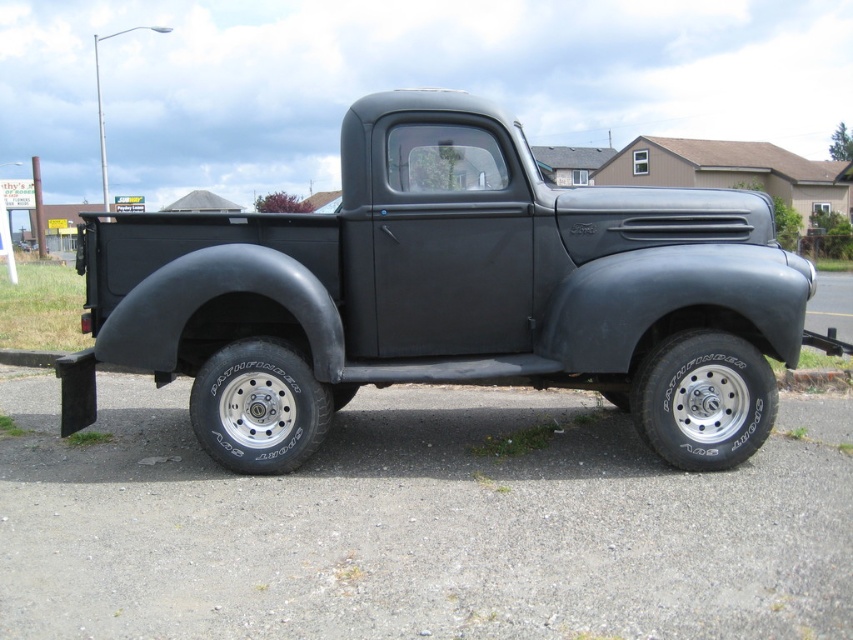
Who is more forward, (654, 204) or (762, 413)?

Point (762, 413) is more forward.

Does matte black truck at center have a lesser height compared to black rubber tire at lower right?

In fact, matte black truck at center may be taller than black rubber tire at lower right.

What do you see at coordinates (450, 294) in the screenshot? Image resolution: width=853 pixels, height=640 pixels. I see `matte black truck at center` at bounding box center [450, 294].

Identify the location of matte black truck at center. pos(450,294).

Does matte black truck at center have a lesser height compared to black rubber tire at lower center?

No.

Looking at this image, does matte black truck at center appear on the right side of black rubber tire at lower center?

Correct, you'll find matte black truck at center to the right of black rubber tire at lower center.

Is point (498, 109) closer to viewer compared to point (265, 390)?

That is False.

Identify the location of matte black truck at center. (450, 294).

Can you confirm if black rubber tire at lower right is smaller than black rubber tire at lower center?

Incorrect, black rubber tire at lower right is not smaller in size than black rubber tire at lower center.

Can you confirm if black rubber tire at lower right is positioned above black rubber tire at lower center?

Yes, black rubber tire at lower right is above black rubber tire at lower center.

Describe the element at coordinates (703, 400) in the screenshot. I see `black rubber tire at lower right` at that location.

What are the coordinates of `black rubber tire at lower right` in the screenshot? It's located at (703, 400).